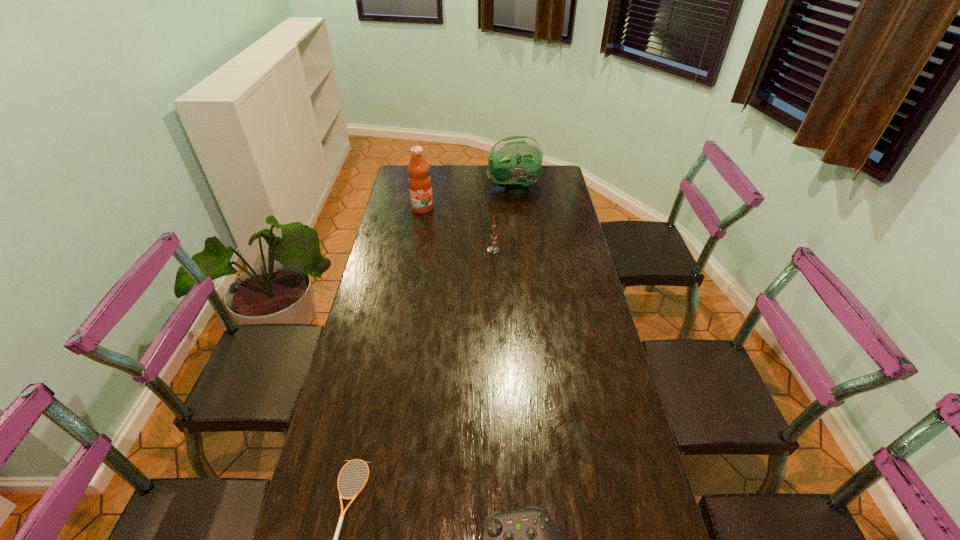
Locate an element on the screen. fruit juice is located at coordinates (420, 187).

Find the location of a particular element. football helmet is located at coordinates click(x=515, y=162).

Find the location of a particular element. This screenshot has height=540, width=960. the third tallest object is located at coordinates (493, 249).

Locate an element on the screen. the third farthest object is located at coordinates (493, 249).

This screenshot has width=960, height=540. Find the location of `free space located 0.200m on the front label of the fruit juice`. free space located 0.200m on the front label of the fruit juice is located at coordinates (417, 242).

The image size is (960, 540). I want to click on vacant space situated 0.250m on the visor of the farthest object, so click(x=435, y=189).

At what (x,y) coordinates should I click in order to perform the action: click on blank space located 0.180m on the visor of the farthest object. Please return your answer as a coordinate pair (x, y). Looking at the image, I should click on (449, 189).

Locate an element on the screen. The height and width of the screenshot is (540, 960). vacant space located 0.340m on the visor of the farthest object is located at coordinates (416, 189).

Where is `vacant space situated on the front-facing side of the third nearest object`? vacant space situated on the front-facing side of the third nearest object is located at coordinates (396, 250).

Image resolution: width=960 pixels, height=540 pixels. I want to click on free location located on the front-facing side of the third nearest object, so click(428, 250).